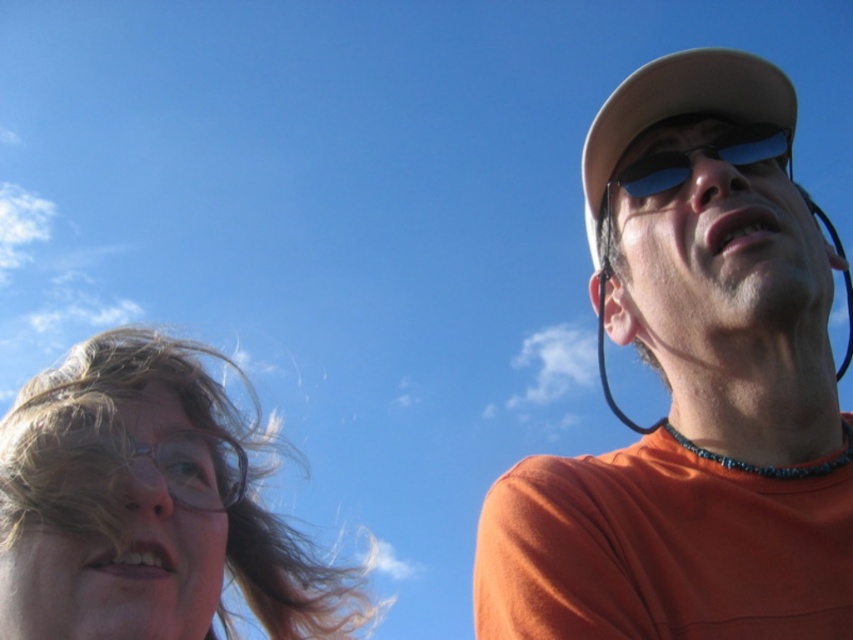
You are a photographer trying to capture both the translucent plastic glasses at left and the sunglasses at upper right in a single frame. Based on their positions, which object should you focus on first to ensure both are in the frame?

Since the translucent plastic glasses at left is below sunglasses at upper right, you should focus on the sunglasses at upper right first to ensure both are within the frame.

Looking at the two people in the image, which object is positioned to the left of the other between the orange matte shirt at right and the sunglasses at upper right?

The orange matte shirt at right is positioned to the left of the sunglasses at upper right.